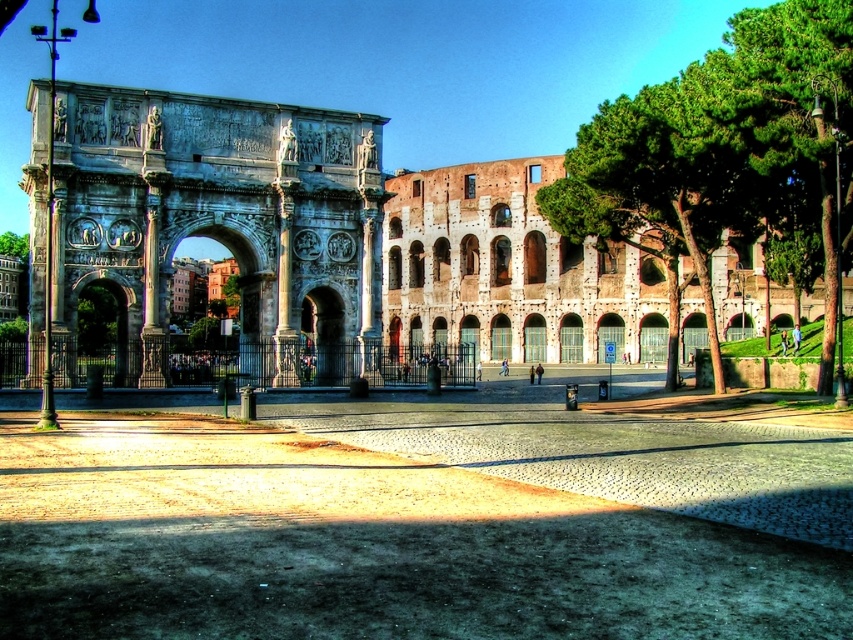
In the scene shown: Between stone archway at left and green leafy tree at right, which one has more height?

With more height is green leafy tree at right.

Is point (373, 208) behind point (741, 54)?

Yes, it is behind point (741, 54).

Who is more distant from viewer, (115, 186) or (828, 339)?

The point (828, 339) is behind.

Locate an element on the screen. The height and width of the screenshot is (640, 853). stone archway at left is located at coordinates (204, 212).